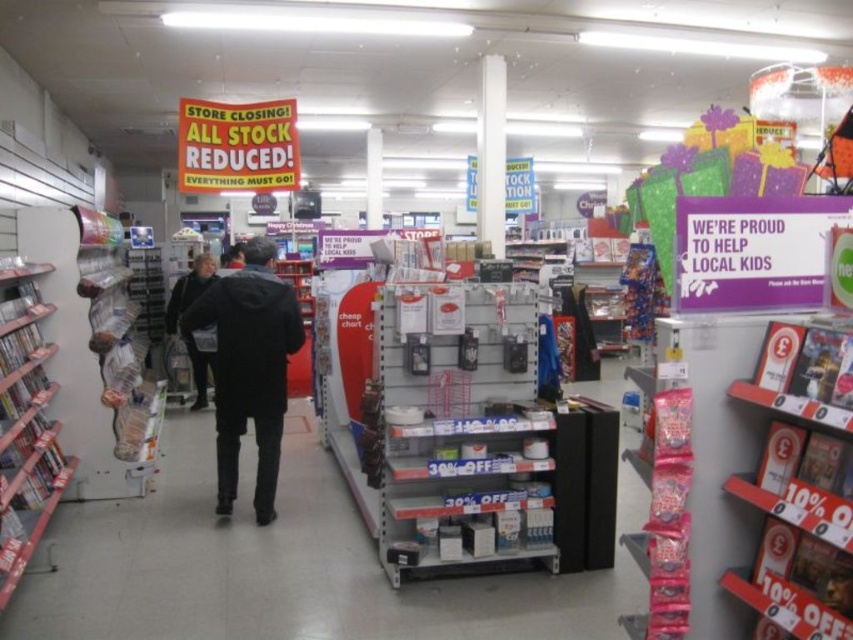
Can you confirm if black matte jacket at center is positioned to the left of dark gray sweater at center?

No, black matte jacket at center is not to the left of dark gray sweater at center.

Is point (276, 410) positioned in front of point (202, 285)?

Yes.

Where is `black matte jacket at center`? The height and width of the screenshot is (640, 853). black matte jacket at center is located at coordinates (248, 368).

This screenshot has width=853, height=640. What are the coordinates of `black matte jacket at center` in the screenshot? It's located at (248, 368).